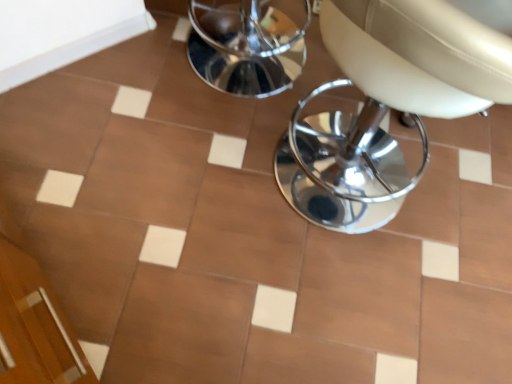
Question: Considering the positions of point (359, 117) and point (138, 44), is point (359, 117) closer or farther from the camera than point (138, 44)?

Choices:
 (A) farther
 (B) closer

Answer: (B)

Question: From a real-world perspective, is white leather chair at center positioned above or below white glossy tile at upper left?

Choices:
 (A) below
 (B) above

Answer: (B)

Question: Considering the positions of white leather chair at center and white glossy tile at upper left in the image, is white leather chair at center taller or shorter than white glossy tile at upper left?

Choices:
 (A) short
 (B) tall

Answer: (B)

Question: Would you say white glossy tile at upper left is to the left or to the right of white leather chair at center in the picture?

Choices:
 (A) right
 (B) left

Answer: (B)

Question: From the image's perspective, is white glossy tile at upper left located above or below white leather chair at center?

Choices:
 (A) below
 (B) above

Answer: (B)

Question: Is white glossy tile at upper left taller or shorter than white leather chair at center?

Choices:
 (A) tall
 (B) short

Answer: (B)

Question: Considering the positions of white glossy tile at upper left and white leather chair at center in the image, is white glossy tile at upper left bigger or smaller than white leather chair at center?

Choices:
 (A) small
 (B) big

Answer: (A)